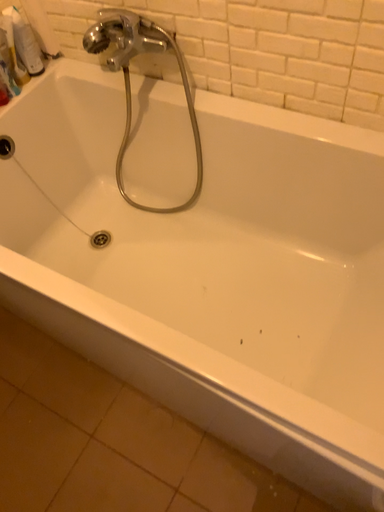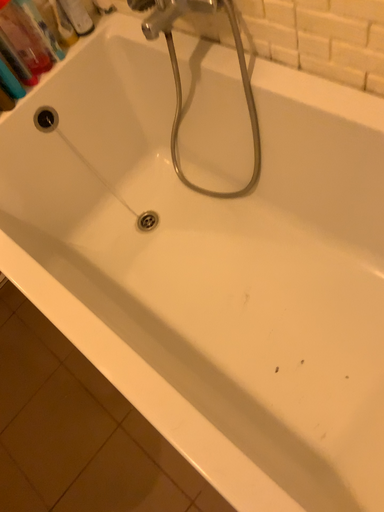
Question: Which way did the camera rotate in the video?

Choices:
 (A) rotated upward
 (B) rotated downward

Answer: (B)